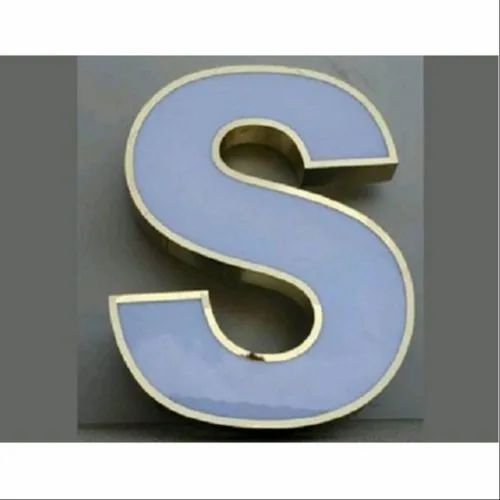
At what (x,y) coordinates should I click in order to perform the action: click on wall detail. Please return your answer as a coordinate pair (x, y). This screenshot has width=500, height=500. Looking at the image, I should click on (391, 426).